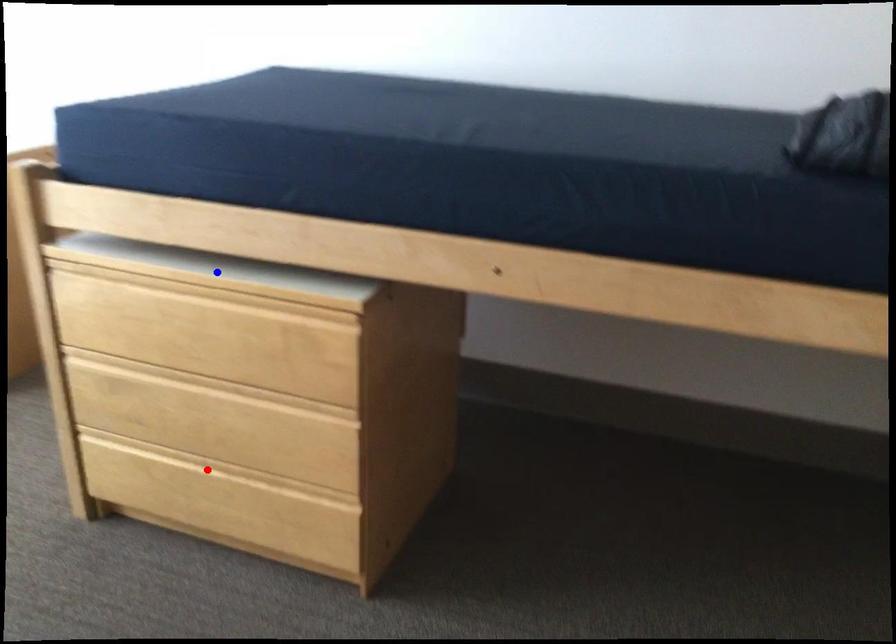
Question: Two points are marked on the image. Which point is closer to the camera?

Choices:
 (A) Blue point is closer.
 (B) Red point is closer.

Answer: (A)